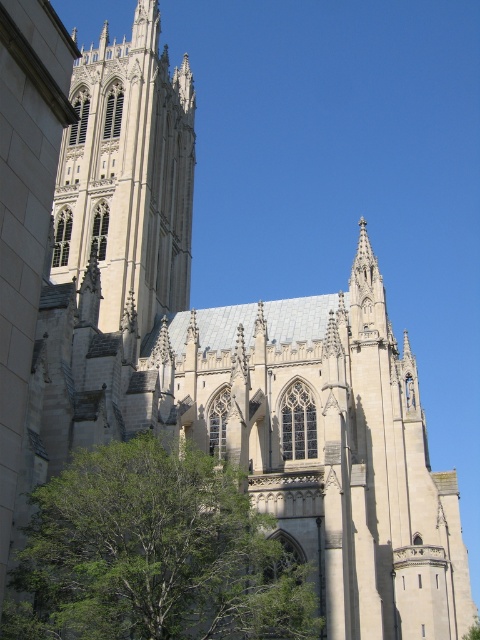
You are a photographer planning to capture the cathedral and the tree in a single shot. Given that the green leafy tree at lower left and the white stone tower at upper left are both in your frame, which object takes up more area in the photo?

The white stone tower at upper left takes up more area in the photo than the green leafy tree at lower left because the green leafy tree at lower left occupies less space than white stone tower at upper left.

You are standing in front of the cathedral and want to take a photo. You notice two points marked on the cathedral facade at coordinates point (98,547) and point (192,83). Which point is closer to your camera when taking the photo?

Point (98,547) is closer to the camera than point (192,83).

You are a drone operator who needs to fly a drone from the green leafy tree at lower left to the white stone tower at upper left. Given that the drone has a maximum flight distance of 120 feet, will it be able to reach the tower without recharging?

The distance between the green leafy tree at lower left and the white stone tower at upper left is 117.76 feet, which is within the drone operator can fly the drone from the green leafy tree at lower left to the white stone tower at upper left without needing to recharge, as the distance is under the 120 feet limit.